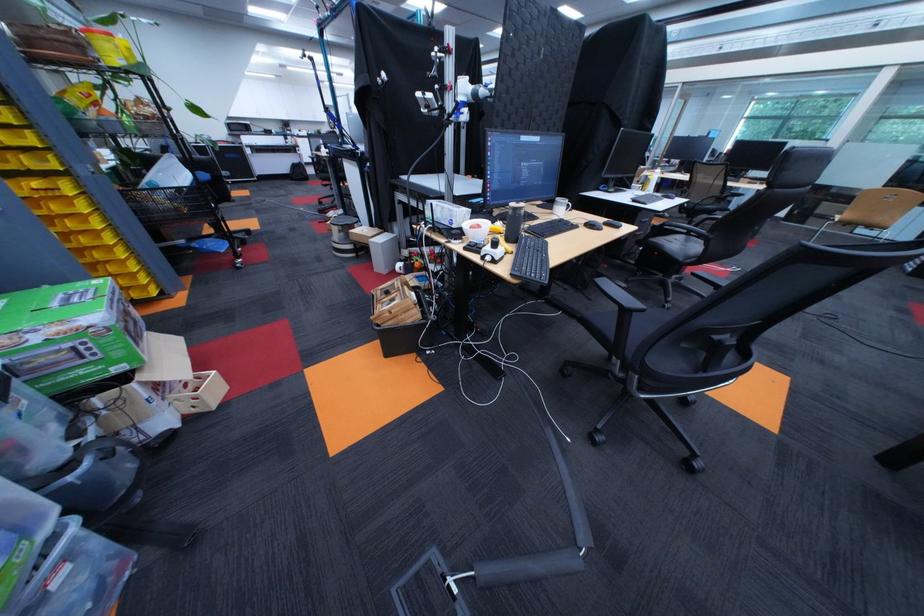
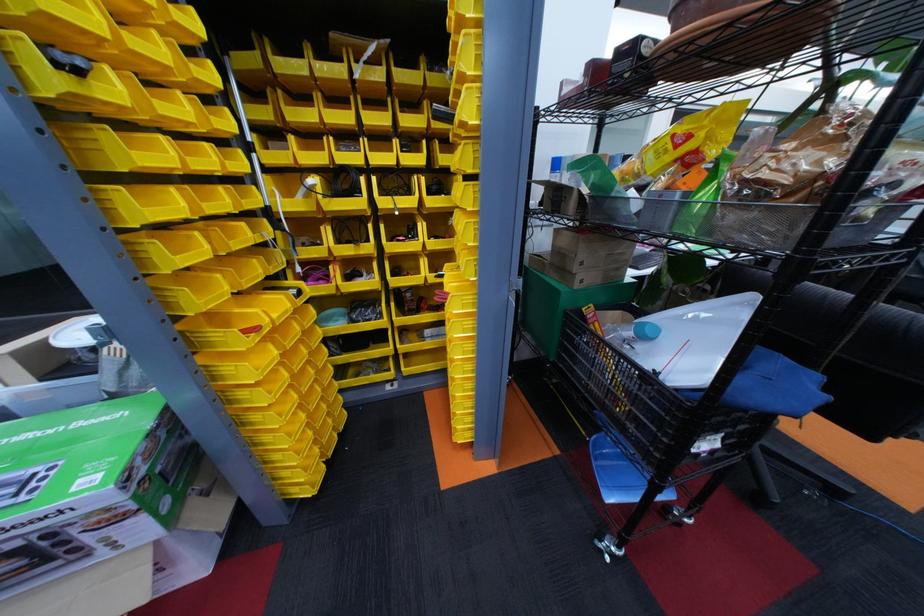
Where in the second image is the point corresponding to point 192,191 from the first image?

(662, 378)